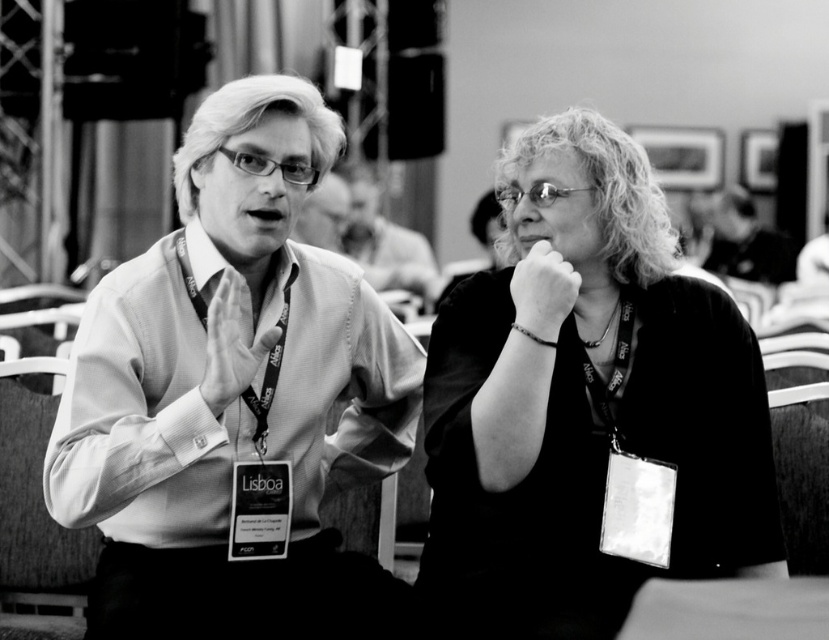
Question: Which point is closer to the camera?

Choices:
 (A) matte black shirt at center
 (B) smooth white shirt at left

Answer: (A)

Question: Does smooth black hair at upper right have a greater width compared to matte white shirt at center?

Choices:
 (A) no
 (B) yes

Answer: (B)

Question: Which point appears farthest from the camera in this image?

Choices:
 (A) (236, 353)
 (B) (348, 417)
 (C) (517, 186)

Answer: (B)

Question: Is smooth skin face at center above matte skin hand at center?

Choices:
 (A) yes
 (B) no

Answer: (A)

Question: Which point is closer to the camera taking this photo?

Choices:
 (A) (86, 484)
 (B) (211, 385)
 (C) (527, 262)
 (D) (362, 163)

Answer: (A)

Question: Is smooth white shirt at left thinner than matte white shirt at center?

Choices:
 (A) yes
 (B) no

Answer: (B)